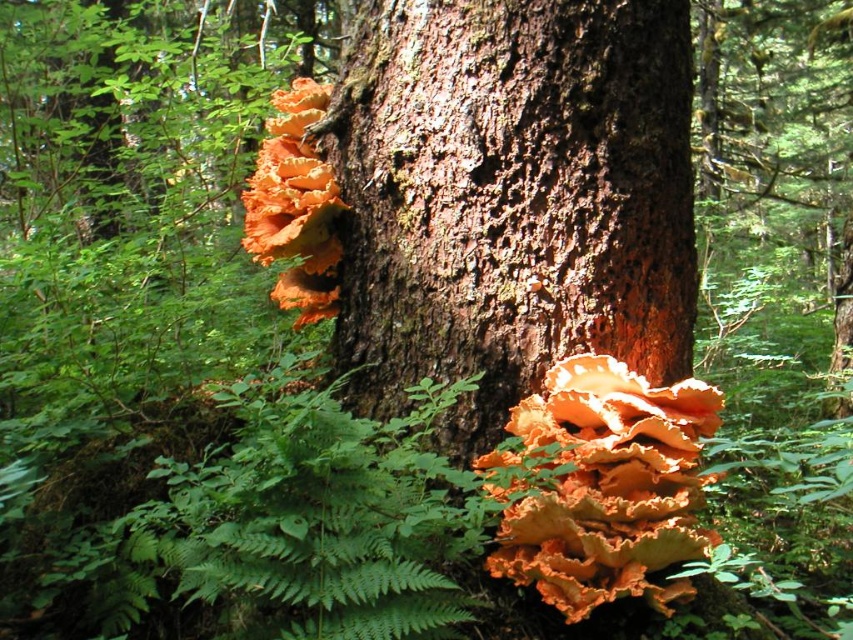
You are a hiker who just found a fascinating orange papery fungus at center growing on a tree trunk. You want to take a closer look without touching it. If you move forward 2 feet, will you be able to see the fungus better?

The orange papery fungus at center is 3.75 feet from the viewer. Moving forward 2 feet would bring you to 1.75 feet away, allowing you to see it better.

You are a small squirrel trying to jump from the rough bark tree trunk at center to the orange papery fungi at upper center. Can you make the jump if your maximum jump distance is 12 inches?

The rough bark tree trunk at center and orange papery fungi at upper center are 12.47 inches apart. Since your maximum jump distance is 12 inches, you cannot make the jump as the distance is slightly longer than your capability.

You are a squirrel that wants to jump from the rough bark tree trunk at center to a nearby branch. The distance between them is 4.06 feet. If your maximum jump distance is 3.5 feet, can you make the jump?

The distance between the rough bark tree trunk at center and the branch is 4.06 feet, which is greater than your maximum jump distance of 3.5 feet. Therefore, you cannot make the jump.